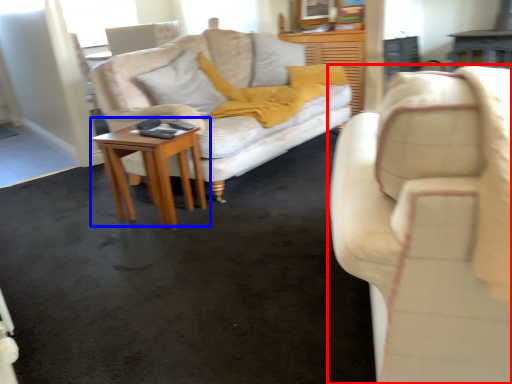
Question: Which object is closer to the camera taking this photo, studio couch (highlighted by a red box) or table (highlighted by a blue box)?

Choices:
 (A) studio couch
 (B) table

Answer: (A)